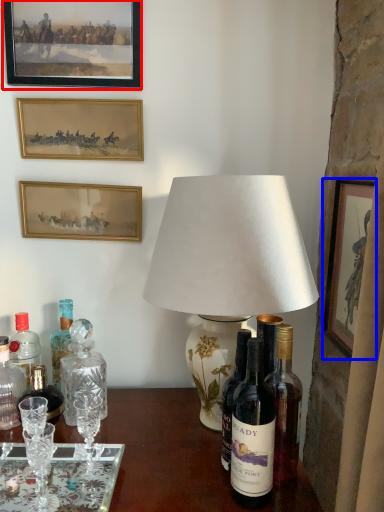
Question: Which object is further to the camera taking this photo, picture frame (highlighted by a red box) or picture frame (highlighted by a blue box)?

Choices:
 (A) picture frame
 (B) picture frame

Answer: (A)